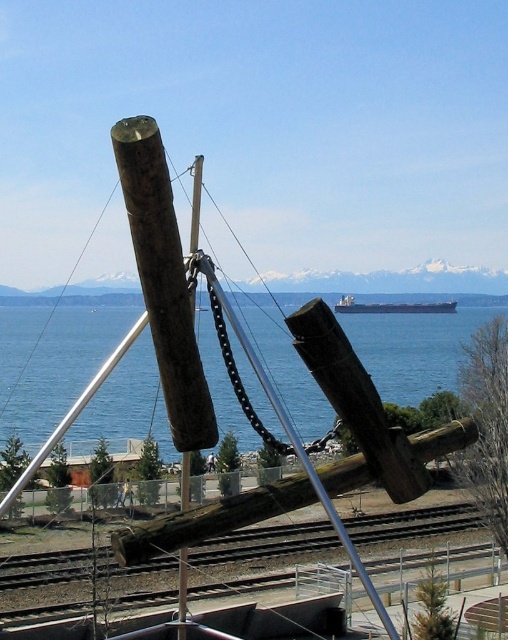
From the picture: Who is lower down, blue water at center or metallic gray ship at center?

Positioned lower is blue water at center.

Does blue water at center lie behind metallic gray ship at center?

No, blue water at center is in front of metallic gray ship at center.

Which is behind, point (92, 362) or point (385, 312)?

Point (385, 312)

Find the location of a particular element. Image resolution: width=508 pixels, height=640 pixels. blue water at center is located at coordinates (415, 348).

Identify the location of blue water at center. This screenshot has width=508, height=640. (415, 348).

From the picture: Who is shorter, blue water at center or wooden log at center?

Standing shorter between the two is wooden log at center.

The image size is (508, 640). Identify the location of blue water at center. (415, 348).

Is blue water at center above brown wooden train track at lower center?

Yes.

Is point (10, 372) less distant than point (198, 566)?

No, (10, 372) is further to viewer.

Identify the location of blue water at center. This screenshot has width=508, height=640. (415, 348).